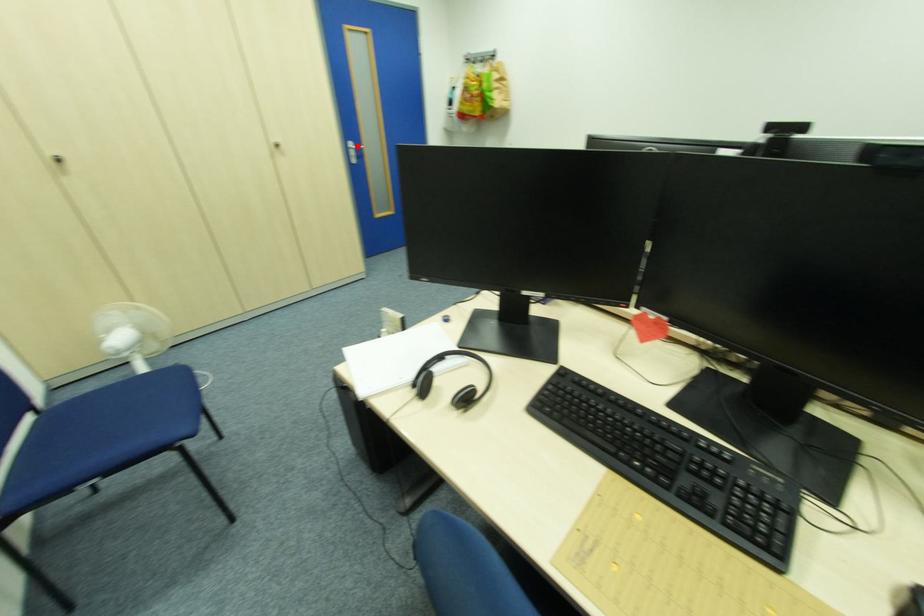
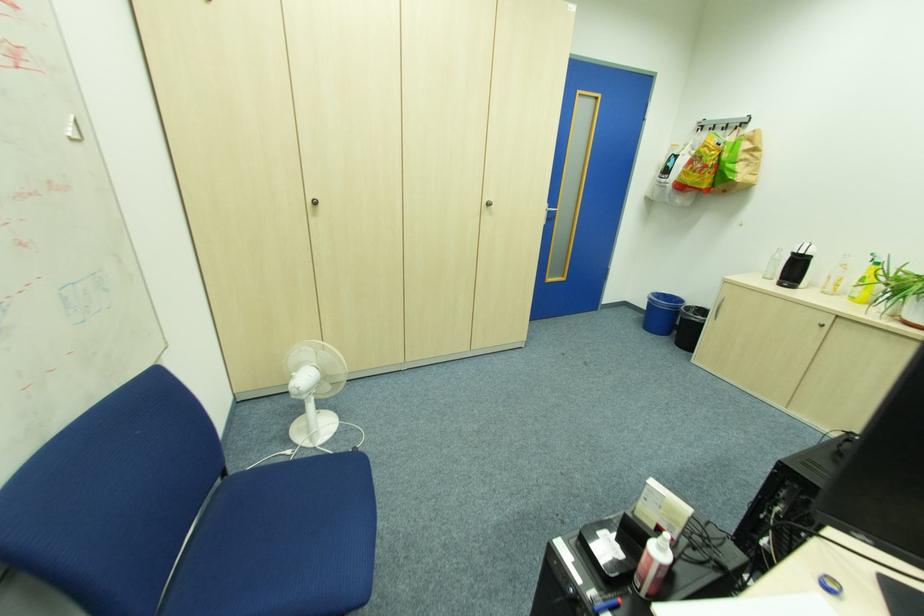
Question: I am providing you with two images of the same scene from different viewpoints. A red point is marked on the first image. At the location where the point appears in image 1, is it still visible in image 2?

Choices:
 (A) Yes
 (B) No

Answer: (B)